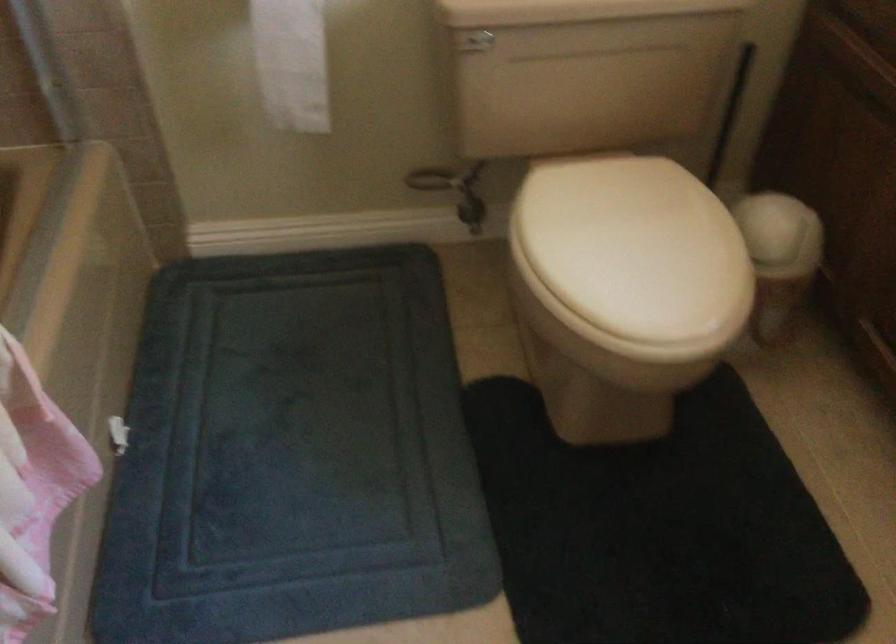
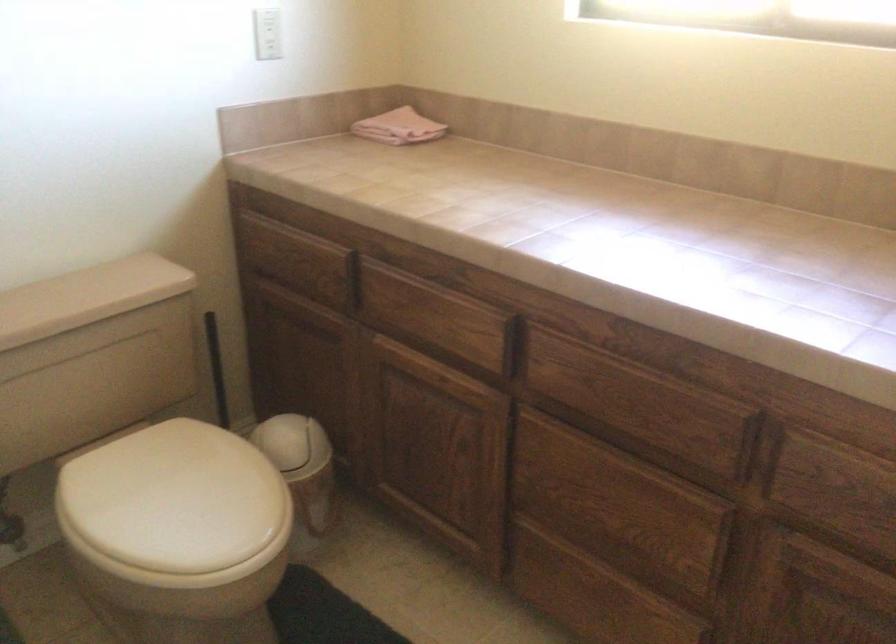
Where in the second image is the point corresponding to point (721, 113) from the first image?

(216, 368)